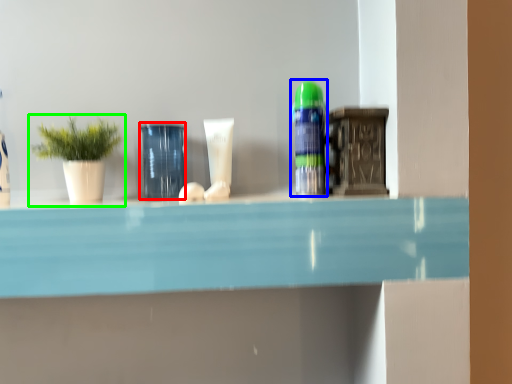
Question: Which is nearer to the glass vase (highlighted by a red box)? toiletry (highlighted by a blue box) or houseplant (highlighted by a green box).

Choices:
 (A) toiletry
 (B) houseplant

Answer: (B)